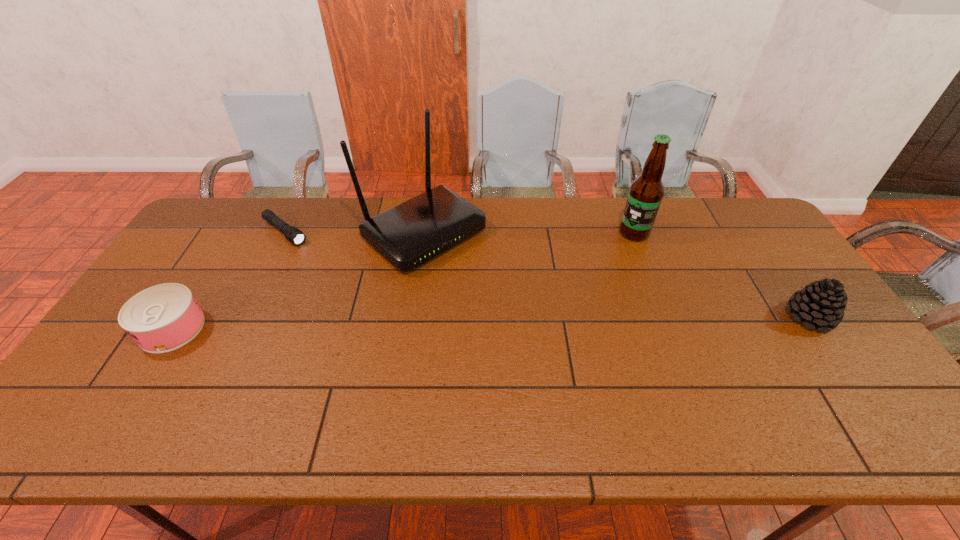
What are the coordinates of `free spot on the desktop that is between the second shortest object and the third shortest object and is positioned on the front-facing side of the router` in the screenshot? It's located at (538, 322).

This screenshot has width=960, height=540. Find the location of `vacant space on the desktop that is between the can and the rightmost object and is positioned on the label of the second object from right to left`. vacant space on the desktop that is between the can and the rightmost object and is positioned on the label of the second object from right to left is located at coordinates (505, 322).

Locate an element on the screen. The width and height of the screenshot is (960, 540). vacant spot on the desktop that is between the can and the rightmost object and is positioned at the lens end of the flashlight is located at coordinates (404, 324).